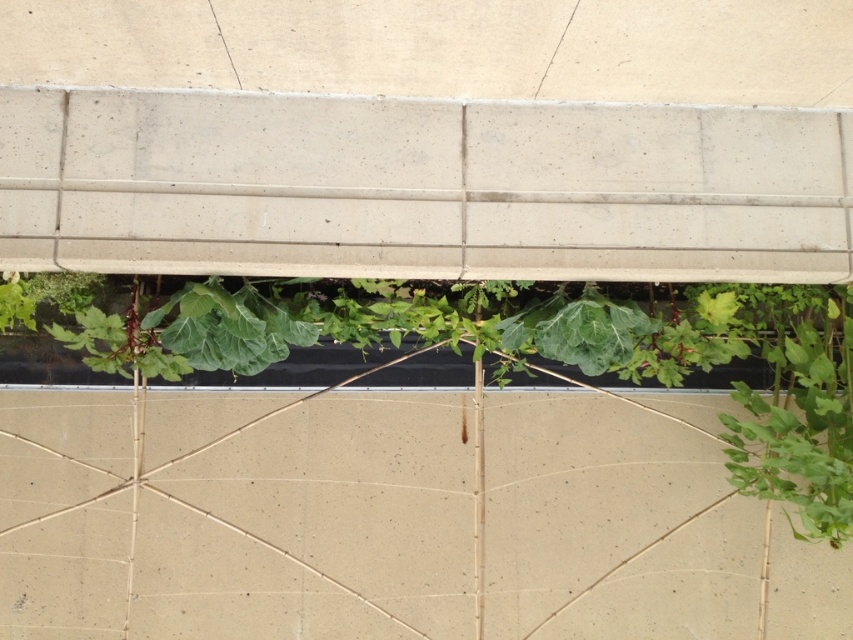
Question: Does smooth beige concrete at center have a larger size compared to green leafy plant at center?

Choices:
 (A) no
 (B) yes

Answer: (B)

Question: Which object appears closest to the camera in this image?

Choices:
 (A) green leafy plant at center
 (B) smooth beige concrete at center

Answer: (A)

Question: Which object is farther from the camera taking this photo?

Choices:
 (A) green leafy plant at center
 (B) smooth beige concrete at center

Answer: (B)

Question: Can you confirm if smooth beige concrete at center is smaller than green leafy plant at center?

Choices:
 (A) yes
 (B) no

Answer: (B)

Question: Which object is farther from the camera taking this photo?

Choices:
 (A) green leafy plant at center
 (B) smooth beige concrete at center

Answer: (B)

Question: Is smooth beige concrete at center wider than green leafy plant at center?

Choices:
 (A) yes
 (B) no

Answer: (A)